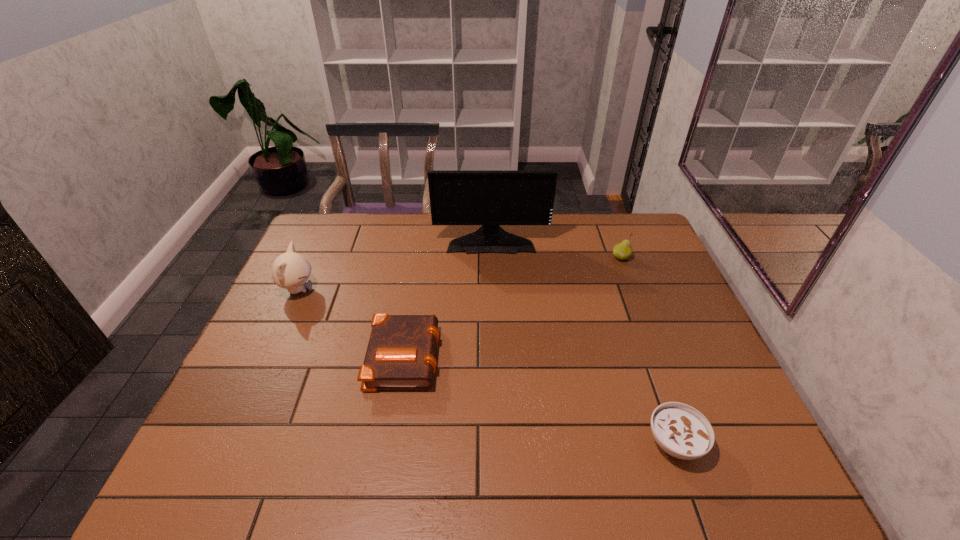
This screenshot has width=960, height=540. In order to click on free region at the near edge of the desktop in this screenshot , I will do `click(476, 482)`.

What are the coordinates of `vacant area at the left edge` in the screenshot? It's located at (316, 298).

This screenshot has height=540, width=960. Find the location of `vacant space at the right edge of the desktop`. vacant space at the right edge of the desktop is located at coordinates (683, 331).

Locate an element on the screen. The image size is (960, 540). free space at the far right corner of the desktop is located at coordinates click(648, 242).

The width and height of the screenshot is (960, 540). What are the coordinates of `vacant area that lies between the third shortest object and the tallest object` in the screenshot? It's located at (556, 248).

You are a GUI agent. You are given a task and a screenshot of the screen. Output one action in this format:
    pyautogui.click(x=<x>, y=<y>)
    Task: Click on the free space between the pear and the kitten
    This screenshot has height=540, width=960.
    Given the screenshot: What is the action you would take?
    pyautogui.click(x=460, y=274)

You are a GUI agent. You are given a task and a screenshot of the screen. Output one action in this format:
    pyautogui.click(x=<x>, y=<y>)
    Task: Click on the free space that is in between the nearest object and the third tallest object
    The width and height of the screenshot is (960, 540).
    Given the screenshot: What is the action you would take?
    pyautogui.click(x=648, y=350)

In order to click on vacant region between the third tallest object and the soup bowl in this screenshot , I will do `click(648, 350)`.

At what (x,y) coordinates should I click in order to perform the action: click on free space between the tallest object and the third nearest object. Please return your answer as a coordinate pair (x, y). The height and width of the screenshot is (540, 960). Looking at the image, I should click on click(395, 265).

This screenshot has width=960, height=540. What are the coordinates of `vacant area that lies between the fourth farthest object and the third farthest object` in the screenshot? It's located at (351, 322).